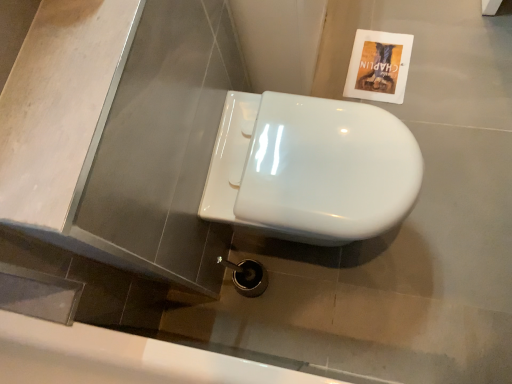
Question: Is white glossy toilet at center oriented towards white glossy bath at lower center?

Choices:
 (A) yes
 (B) no

Answer: (B)

Question: From a real-world perspective, does white glossy toilet at center sit lower than white glossy bath at lower center?

Choices:
 (A) yes
 (B) no

Answer: (A)

Question: From a real-world perspective, is white glossy toilet at center on top of white glossy bath at lower center?

Choices:
 (A) yes
 (B) no

Answer: (B)

Question: From the image's perspective, would you say white glossy toilet at center is positioned over white glossy bath at lower center?

Choices:
 (A) no
 (B) yes

Answer: (B)

Question: Can you confirm if white glossy toilet at center is bigger than white glossy bath at lower center?

Choices:
 (A) no
 (B) yes

Answer: (A)

Question: Can we say white glossy toilet at center lies outside white glossy bath at lower center?

Choices:
 (A) no
 (B) yes

Answer: (B)

Question: Is the depth of white glossy bath at lower center less than that of white glossy toilet at center?

Choices:
 (A) yes
 (B) no

Answer: (A)

Question: Would you say white glossy bath at lower center contains white glossy toilet at center?

Choices:
 (A) no
 (B) yes

Answer: (A)

Question: From a real-world perspective, is white glossy bath at lower center over white glossy toilet at center?

Choices:
 (A) yes
 (B) no

Answer: (A)

Question: From the image's perspective, is white glossy bath at lower center under white glossy toilet at center?

Choices:
 (A) no
 (B) yes

Answer: (B)

Question: From the image's perspective, is white glossy bath at lower center on white glossy toilet at center?

Choices:
 (A) yes
 (B) no

Answer: (B)

Question: From a real-world perspective, is white glossy bath at lower center located beneath white glossy toilet at center?

Choices:
 (A) yes
 (B) no

Answer: (B)

Question: Does white glossy toilet at center have a lesser height compared to matte paper flyer at upper right?

Choices:
 (A) no
 (B) yes

Answer: (A)